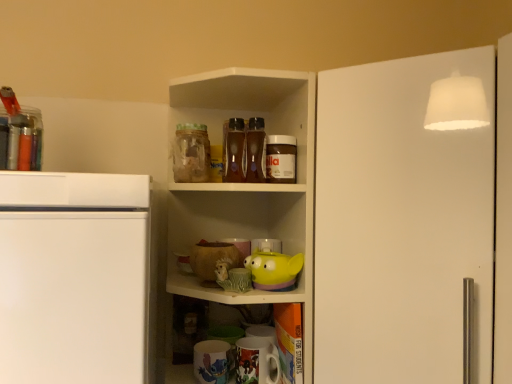
Question: From the image's perspective, is yellow rubber duck at center, arranged as the 2th toy when viewed from the left, above matte ceramic mug at lower center, arranged as the second appliance when viewed from the right?

Choices:
 (A) no
 (B) yes

Answer: (B)

Question: Is yellow rubber duck at center, arranged as the 2th toy when viewed from the left, to the right of matte ceramic mug at lower center, which is the 1th appliance from left to right, from the viewer's perspective?

Choices:
 (A) no
 (B) yes

Answer: (B)

Question: Considering the relative sizes of yellow rubber duck at center, arranged as the 2th toy when viewed from the left, and matte ceramic mug at lower center, which is the 1th appliance from left to right, in the image provided, is yellow rubber duck at center, arranged as the 2th toy when viewed from the left, bigger than matte ceramic mug at lower center, which is the 1th appliance from left to right,?

Choices:
 (A) no
 (B) yes

Answer: (B)

Question: Considering the relative sizes of yellow rubber duck at center, arranged as the 2th toy when viewed from the left, and matte ceramic mug at lower center, which is the 1th appliance from left to right, in the image provided, is yellow rubber duck at center, arranged as the 2th toy when viewed from the left, smaller than matte ceramic mug at lower center, which is the 1th appliance from left to right,?

Choices:
 (A) no
 (B) yes

Answer: (A)

Question: Does yellow rubber duck at center, the 1th toy from the right, have a greater height compared to matte ceramic mug at lower center, which is the 1th appliance from left to right?

Choices:
 (A) yes
 (B) no

Answer: (B)

Question: Considering the relative sizes of yellow rubber duck at center, the 1th toy from the right, and matte ceramic mug at lower center, which is the 1th appliance from left to right, in the image provided, is yellow rubber duck at center, the 1th toy from the right, thinner than matte ceramic mug at lower center, which is the 1th appliance from left to right,?

Choices:
 (A) no
 (B) yes

Answer: (A)

Question: Does white matte door at upper right contain transparent glass jar at upper center, which appears as the 1th beverage when viewed from the left?

Choices:
 (A) yes
 (B) no

Answer: (B)

Question: Is white matte door at upper right not close to transparent glass jar at upper center, which appears as the 1th beverage when viewed from the left?

Choices:
 (A) yes
 (B) no

Answer: (B)

Question: Considering the relative sizes of white matte door at upper right and transparent glass jar at upper center, marked as the 2th beverage in a right-to-left arrangement, in the image provided, is white matte door at upper right shorter than transparent glass jar at upper center, marked as the 2th beverage in a right-to-left arrangement,?

Choices:
 (A) yes
 (B) no

Answer: (B)

Question: Are white matte door at upper right and transparent glass jar at upper center, marked as the 2th beverage in a right-to-left arrangement, beside each other?

Choices:
 (A) no
 (B) yes

Answer: (A)

Question: Does white matte door at upper right come behind transparent glass jar at upper center, which appears as the 1th beverage when viewed from the left?

Choices:
 (A) yes
 (B) no

Answer: (B)

Question: Is white matte door at upper right facing towards transparent glass jar at upper center, which appears as the 1th beverage when viewed from the left?

Choices:
 (A) yes
 (B) no

Answer: (B)

Question: Is smooth chocolate spread at upper center, the first beverage viewed from the right, at the right side of matte green ceramic mug at center, positioned as the first toy in left-to-right order?

Choices:
 (A) no
 (B) yes

Answer: (B)